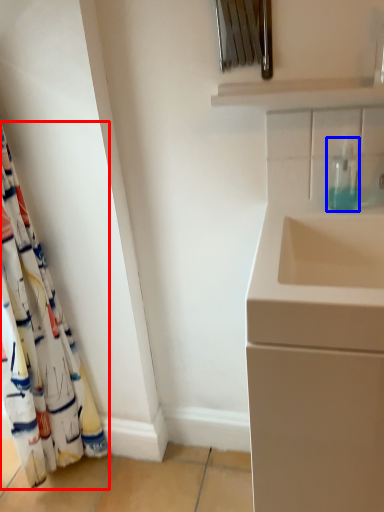
Question: Which point is further to the camera, curtain (highlighted by a red box) or soap dispenser (highlighted by a blue box)?

Choices:
 (A) curtain
 (B) soap dispenser

Answer: (B)